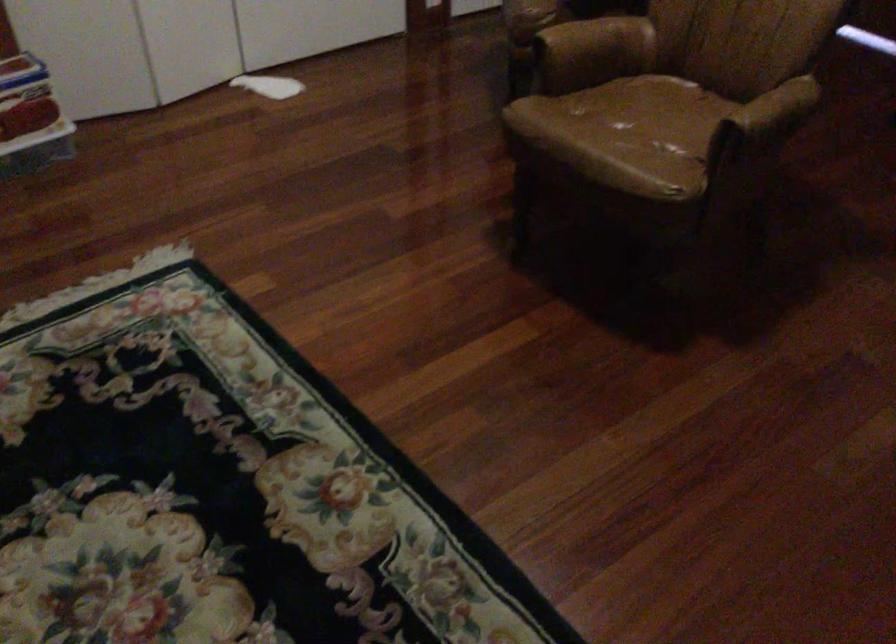
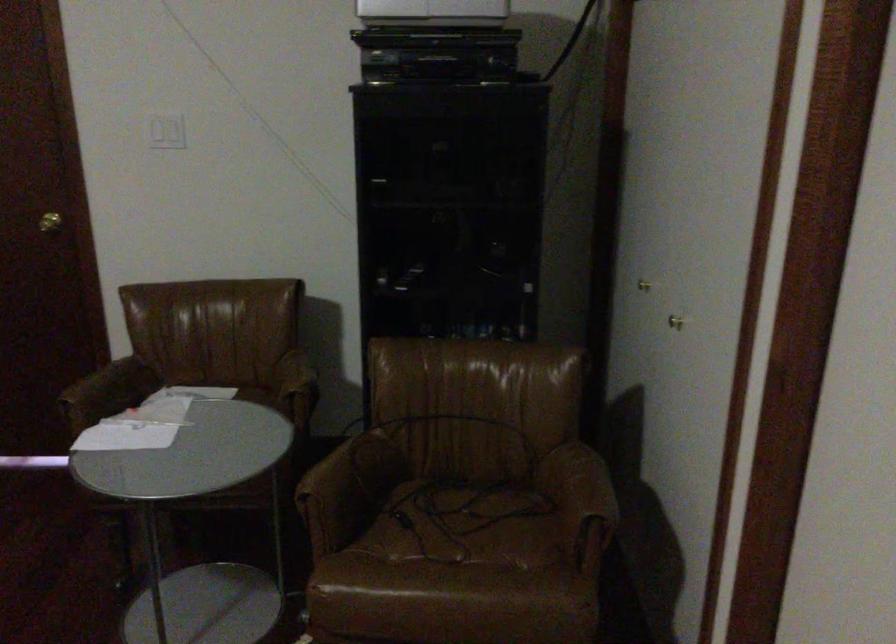
Question: How did the camera likely rotate?

Choices:
 (A) Left
 (B) Right
 (C) Up
 (D) Down

Answer: (B)